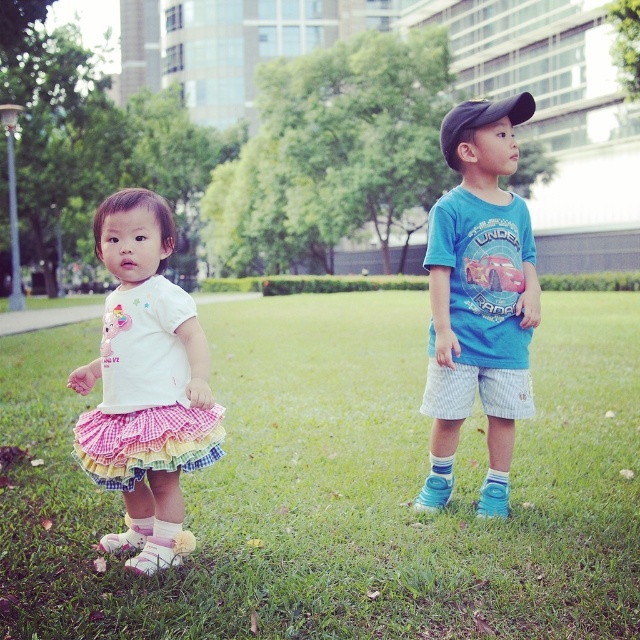
Between point (525, 285) and point (131, 285), which one is positioned behind?

Point (525, 285)

Consider the image. How distant is blue cotton shirt at right from white cotton shirt at center?

A distance of 1.70 meters exists between blue cotton shirt at right and white cotton shirt at center.

Who is more forward, (470, 208) or (131, 349)?

Point (131, 349) is more forward.

Where is `blue cotton shirt at right`? The image size is (640, 640). blue cotton shirt at right is located at coordinates (477, 298).

Does point (490, 320) come in front of point (506, 115)?

No.

Which is in front, point (500, 500) or point (461, 116)?

Point (461, 116) is in front.

Where is `blue cotton shirt at right`? This screenshot has height=640, width=640. blue cotton shirt at right is located at coordinates (477, 298).

Is point (496, 369) in front of point (109, 433)?

No, (496, 369) is further to viewer.

Who is more distant from viewer, (484, 500) or (145, 460)?

Point (484, 500)

This screenshot has height=640, width=640. What are the coordinates of `blue cotton shirt at right` in the screenshot? It's located at (477, 298).

Where is `blue cotton shirt at right`? The width and height of the screenshot is (640, 640). blue cotton shirt at right is located at coordinates (477, 298).